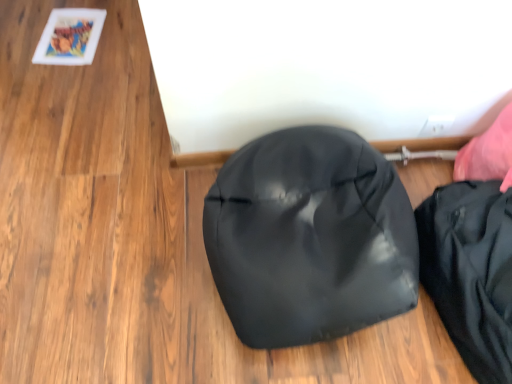
Question: From the image's perspective, relative to matte black shoe at center, is black matte pouch at lower right above or below?

Choices:
 (A) above
 (B) below

Answer: (B)

Question: Is black matte pouch at lower right bigger or smaller than matte black shoe at center?

Choices:
 (A) big
 (B) small

Answer: (B)

Question: Is point (507, 286) positioned closer to the camera than point (254, 324)?

Choices:
 (A) farther
 (B) closer

Answer: (A)

Question: Considering the positions of matte black shoe at center and black matte pouch at lower right in the image, is matte black shoe at center bigger or smaller than black matte pouch at lower right?

Choices:
 (A) small
 (B) big

Answer: (B)

Question: Considering the positions of matte black shoe at center and black matte pouch at lower right in the image, is matte black shoe at center wider or thinner than black matte pouch at lower right?

Choices:
 (A) thin
 (B) wide

Answer: (B)

Question: From the image's perspective, is matte black shoe at center above or below black matte pouch at lower right?

Choices:
 (A) below
 (B) above

Answer: (B)

Question: In the image, is matte black shoe at center positioned in front of or behind black matte pouch at lower right?

Choices:
 (A) behind
 (B) front

Answer: (B)